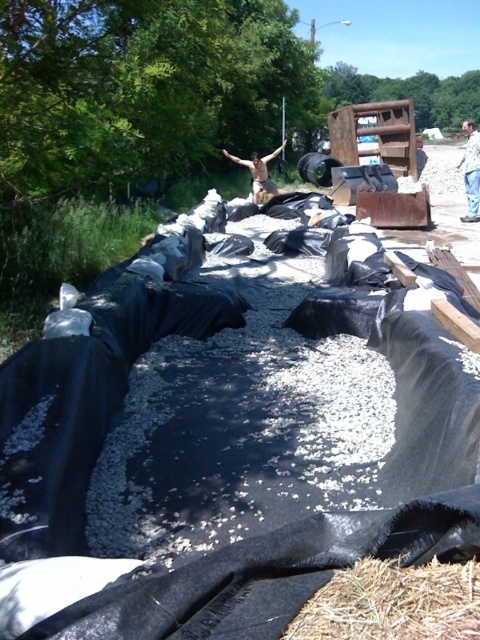
From the picture: Measure the distance from tan fabric shirt at center to skinny man at center.

A distance of 27.21 feet exists between tan fabric shirt at center and skinny man at center.

Can you confirm if tan fabric shirt at center is positioned above skinny man at center?

Yes.

Who is more distant from viewer, (477, 177) or (266, 172)?

Point (266, 172)

This screenshot has width=480, height=640. What are the coordinates of `tan fabric shirt at center` in the screenshot? It's located at (470, 170).

Can you confirm if brown dry hay at lower right is positioned to the left of skinny man at center?

In fact, brown dry hay at lower right is to the right of skinny man at center.

Which is more to the right, brown dry hay at lower right or skinny man at center?

brown dry hay at lower right

Where is `brown dry hay at lower right`? brown dry hay at lower right is located at coordinates (394, 604).

Find the location of a particular element. brown dry hay at lower right is located at coordinates (394, 604).

Is point (437, 627) positioned after point (468, 120)?

No, it is not.

Who is more forward, (x=474, y=608) or (x=467, y=118)?

Point (x=474, y=608)

Where is `brown dry hay at lower right`? brown dry hay at lower right is located at coordinates (394, 604).